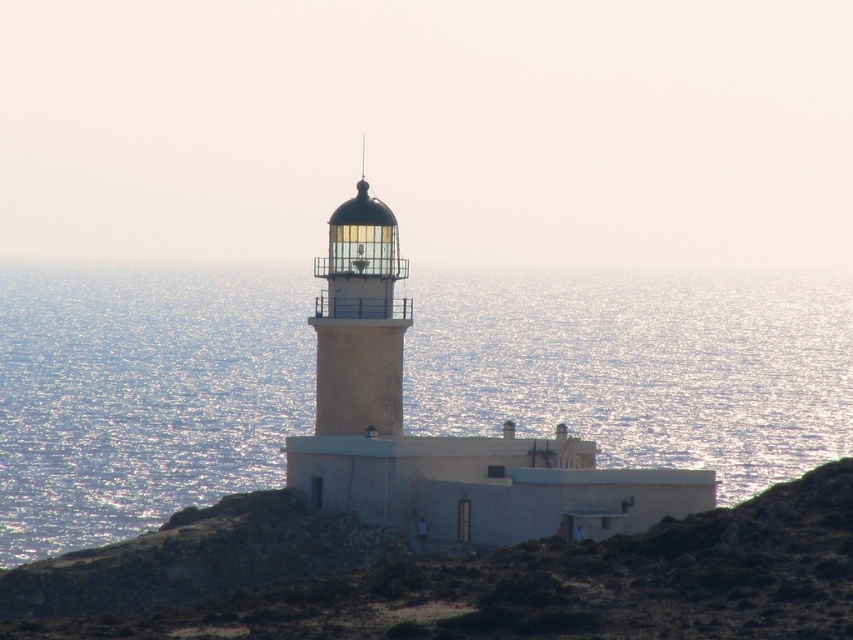
Question: Which point is farther to the camera?

Choices:
 (A) (315, 385)
 (B) (828, 625)
 (C) (799, 392)

Answer: (C)

Question: Can you confirm if brown rocky hillside at center is positioned to the left of white concrete lighthouse at center?

Choices:
 (A) yes
 (B) no

Answer: (B)

Question: Is brown rocky hillside at center to the right of white concrete lighthouse at center from the viewer's perspective?

Choices:
 (A) no
 (B) yes

Answer: (B)

Question: Which object is closer to the camera taking this photo?

Choices:
 (A) white concrete lighthouse at center
 (B) glistening silver water at center

Answer: (A)

Question: Is the position of brown rocky hillside at center more distant than that of white concrete lighthouse at center?

Choices:
 (A) yes
 (B) no

Answer: (B)

Question: Among these points, which one is farthest from the camera?

Choices:
 (A) (223, 317)
 (B) (621, 545)
 (C) (354, 221)

Answer: (A)